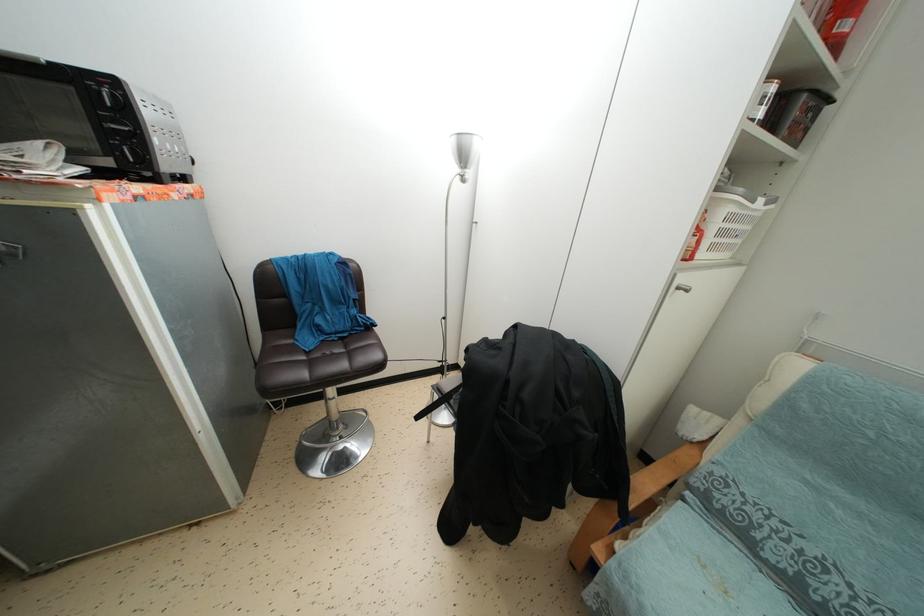
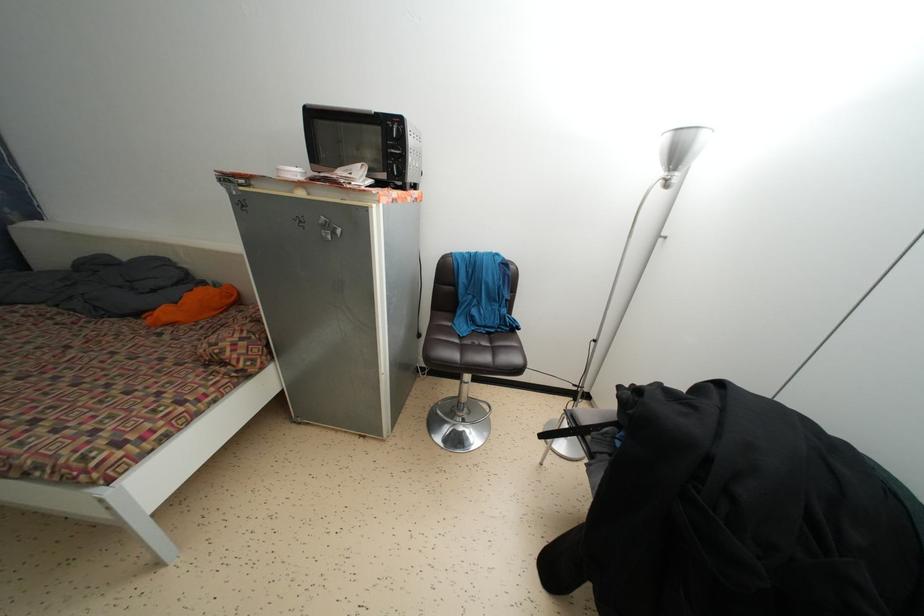
Find the pixel in the second image that matches (100,124) in the first image.

(390, 152)